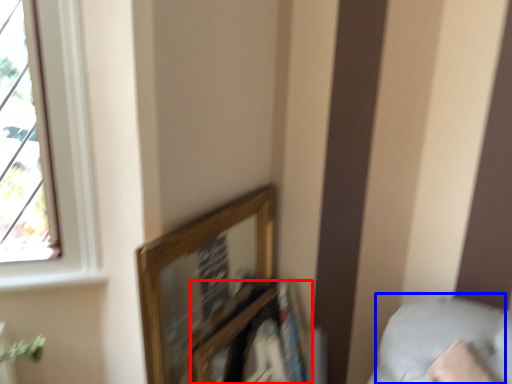
Question: Which object appears farthest to the camera in this image, shelf (highlighted by a red box) or pillow (highlighted by a blue box)?

Choices:
 (A) shelf
 (B) pillow

Answer: (A)